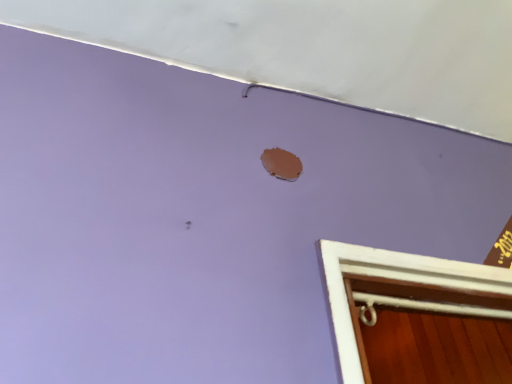
Describe the element at coordinates (316, 48) in the screenshot. The height and width of the screenshot is (384, 512). I see `matte white exhaust hood at upper center` at that location.

This screenshot has height=384, width=512. In order to click on matte white exhaust hood at upper center in this screenshot , I will do `click(316, 48)`.

This screenshot has width=512, height=384. What do you see at coordinates (281, 164) in the screenshot?
I see `matte brown hole at upper center` at bounding box center [281, 164].

Find the location of a particular element. matte brown hole at upper center is located at coordinates (281, 164).

Locate an element on the screen. Image resolution: width=512 pixels, height=384 pixels. matte white exhaust hood at upper center is located at coordinates (316, 48).

Considering the positions of objects matte white exhaust hood at upper center and matte brown hole at upper center in the image provided, who is more to the left, matte white exhaust hood at upper center or matte brown hole at upper center?

Positioned to the left is matte brown hole at upper center.

Considering their positions, is matte white exhaust hood at upper center located in front of or behind matte brown hole at upper center?

matte white exhaust hood at upper center is positioned closer to the viewer than matte brown hole at upper center.

Does point (507, 112) come closer to viewer compared to point (266, 160)?

No.

From the image's perspective, is matte white exhaust hood at upper center beneath matte brown hole at upper center?

Actually, matte white exhaust hood at upper center appears above matte brown hole at upper center in the image.

From a real-world perspective, is matte white exhaust hood at upper center physically above matte brown hole at upper center?

Yes, from a real-world perspective, matte white exhaust hood at upper center is on top of matte brown hole at upper center.

In terms of width, does matte white exhaust hood at upper center look wider or thinner when compared to matte brown hole at upper center?

In the image, matte white exhaust hood at upper center appears to be wider than matte brown hole at upper center.

From the picture: Considering the sizes of objects matte white exhaust hood at upper center and matte brown hole at upper center in the image provided, who is shorter, matte white exhaust hood at upper center or matte brown hole at upper center?

matte white exhaust hood at upper center is shorter.

Who is bigger, matte white exhaust hood at upper center or matte brown hole at upper center?

Bigger between the two is matte white exhaust hood at upper center.

Could matte brown hole at upper center be considered to be inside matte white exhaust hood at upper center?

Definitely not — matte brown hole at upper center is not inside matte white exhaust hood at upper center.

Is matte white exhaust hood at upper center far from matte brown hole at upper center?

No, matte white exhaust hood at upper center is not far from matte brown hole at upper center.

Based on the photo, is matte white exhaust hood at upper center facing away from matte brown hole at upper center?

No, matte white exhaust hood at upper center's orientation is not away from matte brown hole at upper center.

Find the location of `hole located below the matte white exhaust hood at upper center (from the image's perspective)`. hole located below the matte white exhaust hood at upper center (from the image's perspective) is located at coordinates (281, 164).

Between matte brown hole at upper center and matte white exhaust hood at upper center, which one appears on the right side from the viewer's perspective?

matte white exhaust hood at upper center.

Is matte brown hole at upper center in front of matte white exhaust hood at upper center?

That is False.

Between point (276, 162) and point (167, 7), which one is positioned behind?

Point (167, 7)

Based on the photo, from the image's perspective, between matte brown hole at upper center and matte white exhaust hood at upper center, who is located below?

matte brown hole at upper center, from the image's perspective.

From a real-world perspective, who is located higher, matte brown hole at upper center or matte white exhaust hood at upper center?

matte white exhaust hood at upper center is physically above.

Which object is wider, matte brown hole at upper center or matte white exhaust hood at upper center?

matte white exhaust hood at upper center is wider.

Is matte brown hole at upper center taller or shorter than matte white exhaust hood at upper center?

Considering their sizes, matte brown hole at upper center has more height than matte white exhaust hood at upper center.

Considering the sizes of objects matte brown hole at upper center and matte white exhaust hood at upper center in the image provided, who is bigger, matte brown hole at upper center or matte white exhaust hood at upper center?

matte white exhaust hood at upper center is bigger.

Would you say matte brown hole at upper center is outside matte white exhaust hood at upper center?

Yes, matte brown hole at upper center is not within matte white exhaust hood at upper center.

Is matte brown hole at upper center directly adjacent to matte white exhaust hood at upper center?

They are not placed beside each other.

Does matte brown hole at upper center turn towards matte white exhaust hood at upper center?

No, matte brown hole at upper center is not facing towards matte white exhaust hood at upper center.

How far apart are matte brown hole at upper center and matte white exhaust hood at upper center?

matte brown hole at upper center and matte white exhaust hood at upper center are 14.52 inches apart.

Locate an element on the screen. hole that is under the matte white exhaust hood at upper center (from a real-world perspective) is located at coordinates (281, 164).

Locate an element on the screen. This screenshot has height=384, width=512. hole behind the matte white exhaust hood at upper center is located at coordinates (281, 164).

Find the location of a particular element. Image resolution: width=512 pixels, height=384 pixels. exhaust hood in front of the matte brown hole at upper center is located at coordinates (316, 48).